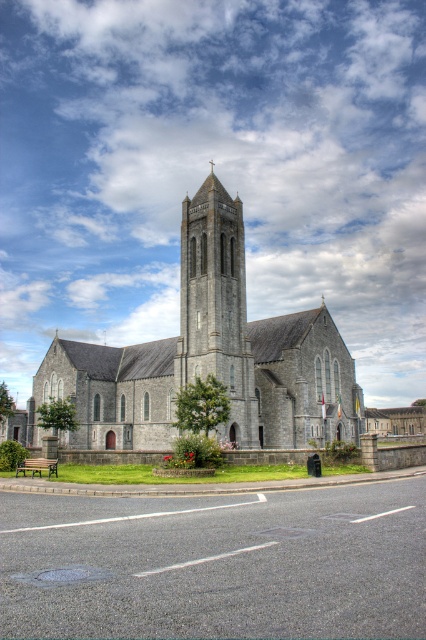
Does gray stone church at center lie behind smooth stone tower at center?

Answer: No, it is not.

The width and height of the screenshot is (426, 640). In order to click on gray stone church at center in this screenshot , I will do `click(210, 358)`.

What do you see at coordinates (210, 358) in the screenshot? I see `gray stone church at center` at bounding box center [210, 358].

The height and width of the screenshot is (640, 426). I want to click on gray stone church at center, so click(x=210, y=358).